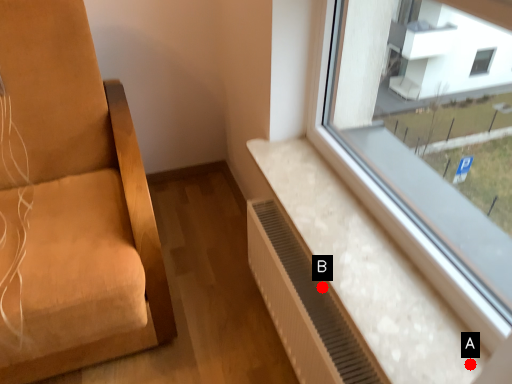
Question: Two points are circled on the image, labeled by A and B beside each circle. Which point appears closest to the camera in this image?

Choices:
 (A) A is closer
 (B) B is closer

Answer: (A)